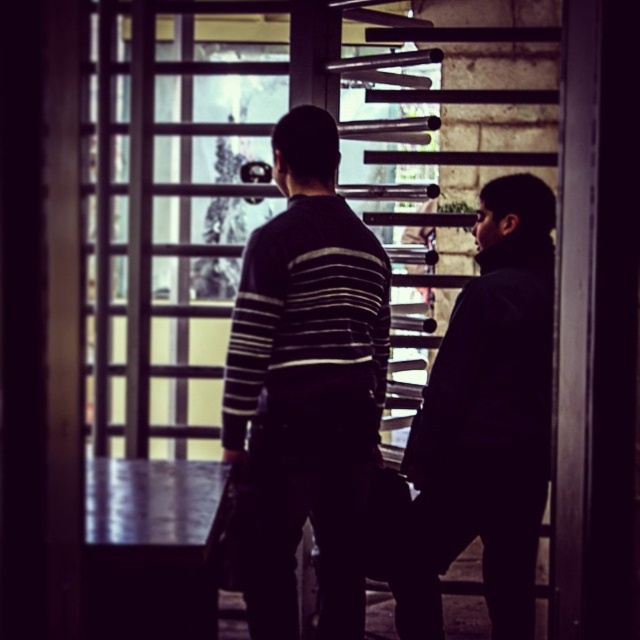
You are a photographer trying to capture a clear shot of both the striped sweater at center and the dark matte jacket at right. Since you can only focus on one subject at a time, which should you choose to ensure the other is still somewhat in focus?

The striped sweater at center is closer to the viewer than the dark matte jacket at right, so focusing on the striped sweater at center will keep the dark matte jacket at right in better focus due to the depth of field extending further behind the closer subject.

Based on the photo, you are an interior designer working on a layout for a room with a window that has a grid structure. You have a striped sweater placed at point 0.602, 0.481 in the room. Where should you place a new sofa so that it is directly to the right of the striped sweater at center?

The striped sweater at center is located at coordinates (307,385). To place the sofa directly to the right of it, you would position the sofa at a point with an x coordinate greater than 0.602 while maintaining the same y coordinate of 0.481.

You are standing in the room and want to touch the two points on the window. Which point, point (314, 440) or point (504, 520), is closer to you?

Point (314, 440) is closer to the viewer than point (504, 520).